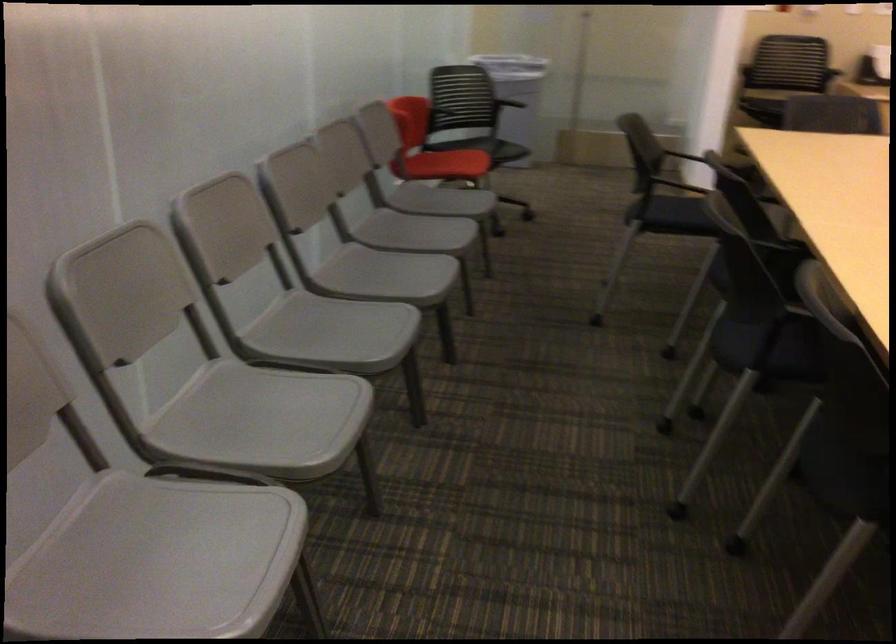
This screenshot has height=644, width=896. Find the location of `red chair sitting surface`. red chair sitting surface is located at coordinates (446, 164).